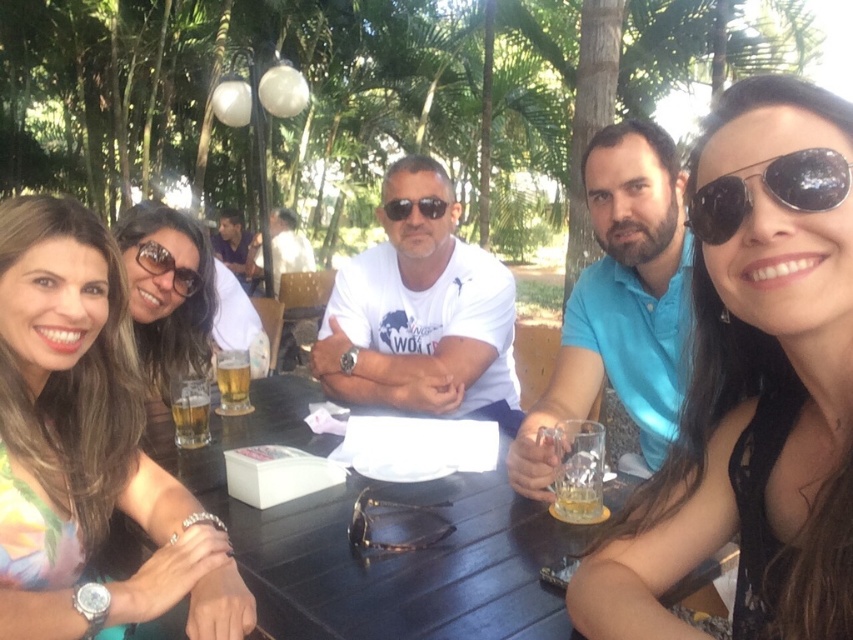
Question: Is matte black sunglasses at upper left thinner than matte black sunglasses at center?

Choices:
 (A) yes
 (B) no

Answer: (B)

Question: Which object appears farthest from the camera in this image?

Choices:
 (A) floral fabric dress at lower left
 (B) translucent glass beer at center

Answer: (B)

Question: Can you confirm if brown textured glasses at center is positioned to the left of matte black goggles at upper left?

Choices:
 (A) yes
 (B) no

Answer: (B)

Question: Which of the following is the farthest from the observer?

Choices:
 (A) (236, 380)
 (B) (782, 195)

Answer: (A)

Question: Considering the real-world distances, which object is farthest from the blue satin polo shirt at center?

Choices:
 (A) translucent glass beer at table center
 (B) matte black goggles at upper left
 (C) matte white shirt at center
 (D) black wood table at center

Answer: (C)

Question: Is brown textured glasses at center bigger than white t-shirt at center?

Choices:
 (A) no
 (B) yes

Answer: (A)